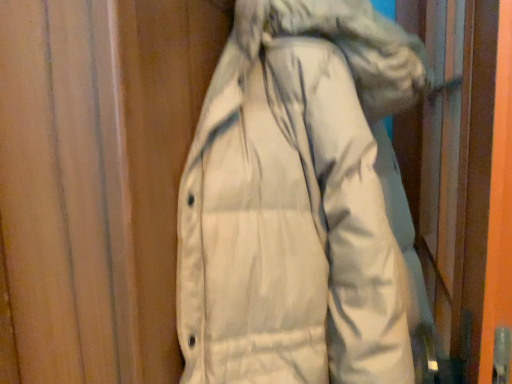
Measure the distance between white matte jacket at center and camera.

white matte jacket at center is 20.24 inches from camera.

Where is `white matte jacket at center`? This screenshot has width=512, height=384. white matte jacket at center is located at coordinates [295, 202].

Describe the element at coordinates (295, 202) in the screenshot. I see `white matte jacket at center` at that location.

I want to click on white matte jacket at center, so click(x=295, y=202).